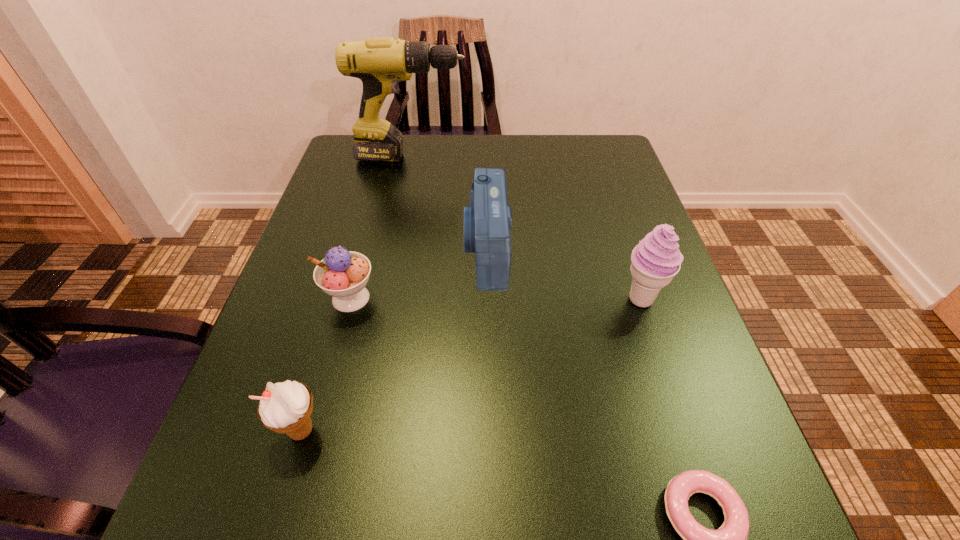
The height and width of the screenshot is (540, 960). What are the coordinates of `the tallest object` in the screenshot? It's located at (380, 63).

Find the location of `drill`. drill is located at coordinates (380, 63).

Find the location of a particular element. The image size is (960, 540). the rightmost icecream is located at coordinates (655, 261).

You are a GUI agent. You are given a task and a screenshot of the screen. Output one action in this format:
    pyautogui.click(x=<x>, y=<y>)
    Task: Click on the fifth shortest object
    This screenshot has width=960, height=540.
    Given the screenshot: What is the action you would take?
    pyautogui.click(x=655, y=261)

The width and height of the screenshot is (960, 540). Find the location of `the fourth object from left to right`. the fourth object from left to right is located at coordinates (487, 222).

The height and width of the screenshot is (540, 960). In order to click on the fifth farthest object in this screenshot , I will do `click(286, 407)`.

Find the location of a particular element. vacant position located on the handle side of the tallest object is located at coordinates (612, 157).

I want to click on vacant space located on the left of the second tallest object, so click(x=490, y=299).

Identify the location of blank area located 0.100m on the lens of the fourth object from left to right. (414, 250).

This screenshot has height=540, width=960. Identify the location of blank space located 0.270m on the lens of the fourth object from left to right. (328, 250).